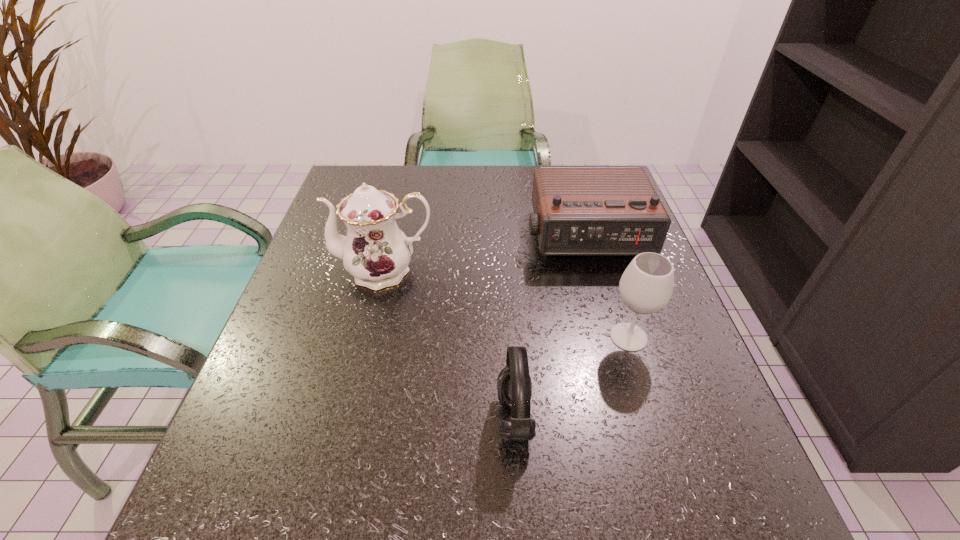
Locate an element on the screen. vacant space at the right edge of the desktop is located at coordinates (646, 333).

The height and width of the screenshot is (540, 960). I want to click on free point at the near right corner, so click(x=691, y=515).

What are the coordinates of `empty space that is in between the chinaware and the radio receiver` in the screenshot? It's located at (485, 253).

Where is `free point between the nearest object and the leftmost object`? free point between the nearest object and the leftmost object is located at coordinates (449, 345).

Where is `free point between the headset and the tallest object`? This screenshot has height=540, width=960. free point between the headset and the tallest object is located at coordinates (449, 345).

This screenshot has height=540, width=960. I want to click on vacant area between the radio receiver and the chinaware, so click(485, 253).

Locate an element on the screen. unoccupied area between the second tallest object and the radio receiver is located at coordinates (607, 286).

The width and height of the screenshot is (960, 540). I want to click on free space that is in between the radio receiver and the leftmost object, so click(x=485, y=253).

You are a GUI agent. You are given a task and a screenshot of the screen. Output one action in this format:
    pyautogui.click(x=<x>, y=<y>)
    Task: Click on the free area in between the radio receiver and the nearest object
    
    Given the screenshot: What is the action you would take?
    pyautogui.click(x=550, y=326)

At what (x,y) coordinates should I click in order to perform the action: click on vacant space that is in between the radio receiver and the nearest object. Please return your answer as a coordinate pair (x, y). The width and height of the screenshot is (960, 540). Looking at the image, I should click on (550, 326).